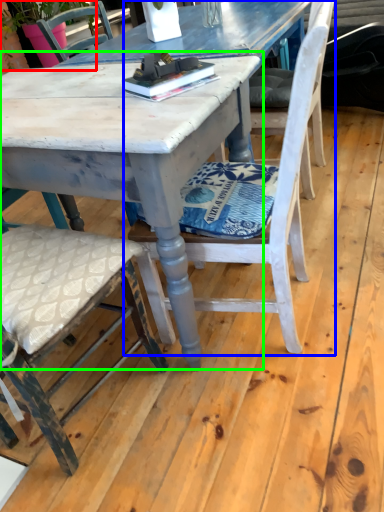
Question: Estimate the real-world distances between objects in this image. Which object is closer to plant (highlighted by a red box), chair (highlighted by a blue box) or round table (highlighted by a green box)?

Choices:
 (A) chair
 (B) round table

Answer: (B)